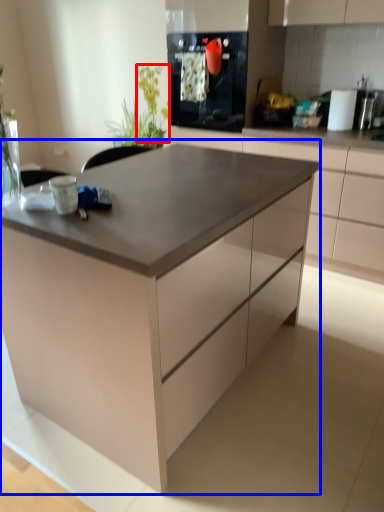
Question: Among these objects, which one is nearest to the camera, plant (highlighted by a red box) or table (highlighted by a blue box)?

Choices:
 (A) plant
 (B) table

Answer: (B)